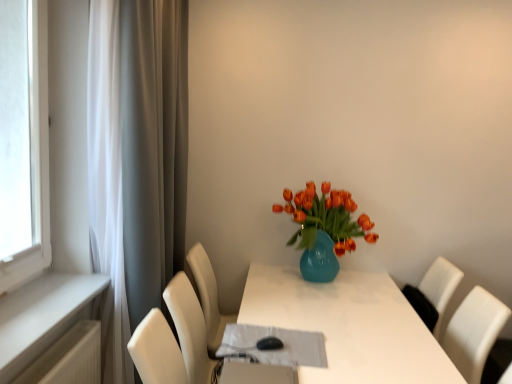
The width and height of the screenshot is (512, 384). What do you see at coordinates (326, 217) in the screenshot?
I see `matte blue vase with orange tulips at center` at bounding box center [326, 217].

Image resolution: width=512 pixels, height=384 pixels. What are the coordinates of `white painted wood at left` in the screenshot? It's located at (42, 316).

Can you tell me how much white painted wood at left and matte blue vase with orange tulips at center differ in facing direction?

They differ by 89.6 degrees in their facing directions.

Is white painted wood at left far away from matte blue vase with orange tulips at center?

white painted wood at left is far away from matte blue vase with orange tulips at center.

From a real-world perspective, does white painted wood at left stand above matte blue vase with orange tulips at center?

Actually, white painted wood at left is physically below matte blue vase with orange tulips at center in the real world.

Is matte blue vase with orange tulips at center located within white painted wood at left?

Actually, matte blue vase with orange tulips at center is outside white painted wood at left.

Between white glossy table at center and matte blue vase with orange tulips at center, which one appears on the right side from the viewer's perspective?

matte blue vase with orange tulips at center.

Where is `flower lying above the white glossy table at center (from the image's perspective)`? flower lying above the white glossy table at center (from the image's perspective) is located at coordinates (326, 217).

Does point (405, 332) appear closer or farther from the camera than point (314, 223)?

Point (405, 332).

Does white glossy table at center have a lesser width compared to matte blue vase with orange tulips at center?

In fact, white glossy table at center might be wider than matte blue vase with orange tulips at center.

Could you tell me if white painted wood at left is facing white glossy table at center?

No, white painted wood at left is not oriented towards white glossy table at center.

Which is in front, point (25, 341) or point (309, 375)?

The point (25, 341) is closer.

How different are the orientations of white painted wood at left and white glossy table at center in degrees?

The angle between the facing direction of white painted wood at left and the facing direction of white glossy table at center is 89.4 degrees.

From the image's perspective, does white painted wood at left appear lower than white glossy table at center?

Actually, white painted wood at left appears above white glossy table at center in the image.

Is point (74, 303) closer or farther from the camera than point (119, 180)?

Point (74, 303) is closer to the camera than point (119, 180).

In terms of height, does white painted wood at left look taller or shorter compared to white matte curtain at left?

white painted wood at left is shorter than white matte curtain at left.

Does white painted wood at left have a greater width compared to white matte curtain at left?

Indeed, white painted wood at left has a greater width compared to white matte curtain at left.

Is white painted wood at left not near white matte curtain at left?

white painted wood at left is near white matte curtain at left, not far away.

From a real-world perspective, which object stands above the other?

white matte curtain at left.

Find the location of a particular element. The height and width of the screenshot is (384, 512). curtain positioned vertically above the white glossy table at center (from a real-world perspective) is located at coordinates (136, 161).

Considering the points (304, 376) and (151, 265), which point is in front, point (304, 376) or point (151, 265)?

The point (304, 376) is more forward.

How far apart are white glossy table at center and white matte curtain at left?

They are 36.56 inches apart.

Which of these two, white matte curtain at left or matte blue vase with orange tulips at center, stands shorter?

Standing shorter between the two is matte blue vase with orange tulips at center.

Based on the photo, from the image's perspective, between white matte curtain at left and matte blue vase with orange tulips at center, which one is located above?

white matte curtain at left is shown above in the image.

Can matte blue vase with orange tulips at center be found inside white matte curtain at left?

No, white matte curtain at left does not contain matte blue vase with orange tulips at center.

Would you consider matte blue vase with orange tulips at center to be distant from white glossy table at center?

matte blue vase with orange tulips at center is near white glossy table at center, not far away.

Looking at this image, considering the sizes of objects matte blue vase with orange tulips at center and white glossy table at center in the image provided, who is wider, matte blue vase with orange tulips at center or white glossy table at center?

Wider between the two is white glossy table at center.

The image size is (512, 384). What are the coordinates of `window sill below the matte blue vase with orange tulips at center (from the image's perspective)` in the screenshot? It's located at (42, 316).

The height and width of the screenshot is (384, 512). Identify the location of flower that is on the right side of white glossy table at center. (326, 217).

From the picture: Considering their positions, is white glossy table at center positioned further to white matte curtain at left than matte blue vase with orange tulips at center?

Among the two, matte blue vase with orange tulips at center is located further to white matte curtain at left.

Based on the photo, which object lies further to the anchor point white matte curtain at left, white glossy table at center or white painted wood at left?

Among the two, white glossy table at center is located further to white matte curtain at left.

Based on their spatial positions, is white matte curtain at left or matte blue vase with orange tulips at center further from white painted wood at left?

Among the two, matte blue vase with orange tulips at center is located further to white painted wood at left.

Estimate the real-world distances between objects in this image. Which object is further from white glossy table at center, matte blue vase with orange tulips at center or white painted wood at left?

Based on the image, white painted wood at left appears to be further to white glossy table at center.

Estimate the real-world distances between objects in this image. Which object is closer to matte blue vase with orange tulips at center, white glossy table at center or white matte curtain at left?

white glossy table at center is positioned closer to the anchor matte blue vase with orange tulips at center.

Based on their spatial positions, is white glossy table at center or white matte curtain at left further from white painted wood at left?

white glossy table at center lies further to white painted wood at left than the other object.

When comparing their distances from matte blue vase with orange tulips at center, does white painted wood at left or white glossy table at center seem closer?

Among the two, white glossy table at center is located nearer to matte blue vase with orange tulips at center.

Looking at the image, which one is located closer to white glossy table at center, white painted wood at left or white matte curtain at left?

The object closer to white glossy table at center is white matte curtain at left.

Locate an element on the screen. The height and width of the screenshot is (384, 512). curtain between white painted wood at left and matte blue vase with orange tulips at center in the horizontal direction is located at coordinates pyautogui.click(x=136, y=161).

This screenshot has height=384, width=512. In order to click on curtain located between white painted wood at left and white glossy table at center in the left-right direction in this screenshot , I will do `click(136, 161)`.

The height and width of the screenshot is (384, 512). I want to click on table between white painted wood at left and matte blue vase with orange tulips at center from left to right, so click(x=349, y=326).

Where is `flower between white matte curtain at left and white glossy table at center vertically`? Image resolution: width=512 pixels, height=384 pixels. flower between white matte curtain at left and white glossy table at center vertically is located at coordinates (326, 217).